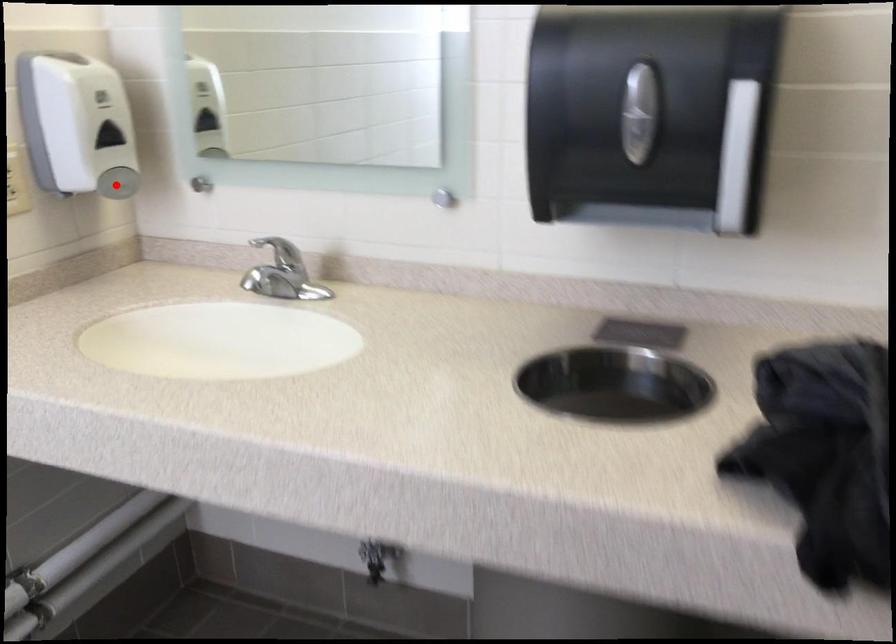
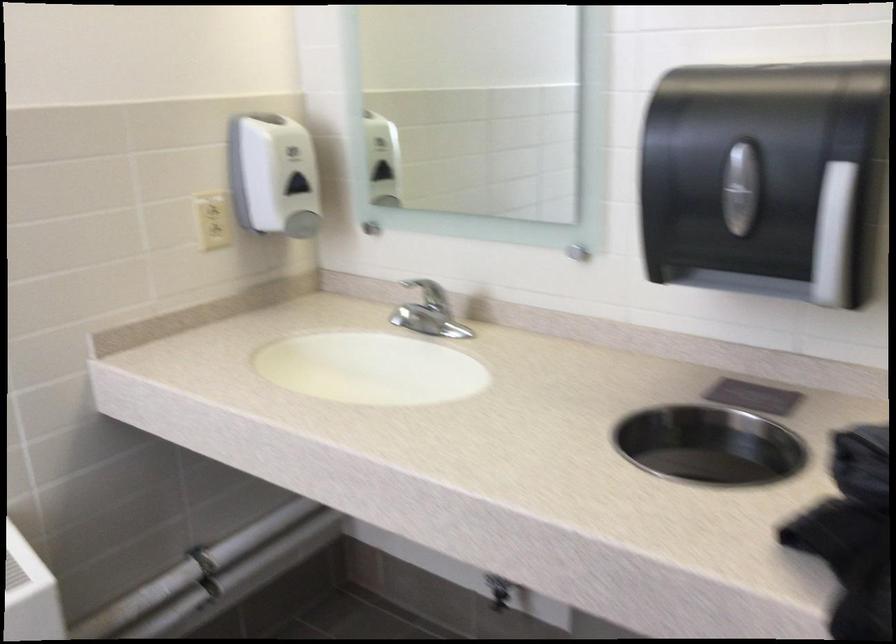
Question: I am providing you with two images of the same scene from different viewpoints. A red point is shown in image1. For the corresponding object point in image2, is it positioned nearer or farther from the camera?

Choices:
 (A) Nearer
 (B) Farther

Answer: (B)